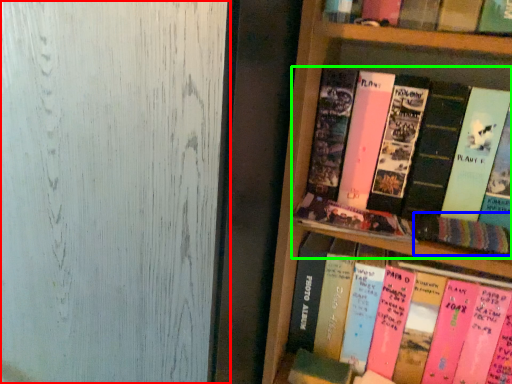
Question: Based on their relative distances, which object is nearer to glass door (highlighted by a red box)? Choose from book (highlighted by a blue box) and book (highlighted by a green box).

Choices:
 (A) book
 (B) book

Answer: (B)